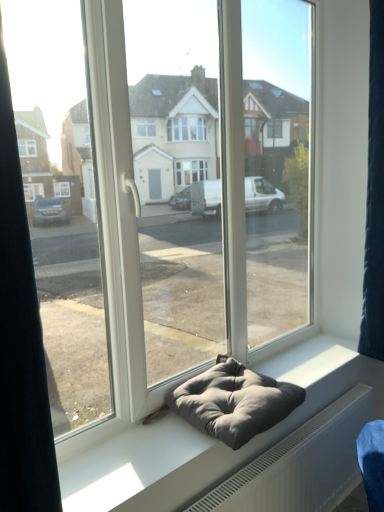
This screenshot has width=384, height=512. What do you see at coordinates (202, 434) in the screenshot?
I see `gray fabric cushion at center` at bounding box center [202, 434].

Locate an element on the screen. transparent glass door at center is located at coordinates (210, 200).

Between dark blue fabric at right and gray fabric cushion at center, which one has larger size?

dark blue fabric at right is bigger.

From their relative heights in the image, would you say dark blue fabric at right is taller or shorter than gray fabric cushion at center?

dark blue fabric at right is taller than gray fabric cushion at center.

In the scene shown: Is dark blue fabric at right completely or partially outside of gray fabric cushion at center?

Yes, dark blue fabric at right is not within gray fabric cushion at center.

How distant is dark blue fabric at right from gray fabric cushion at center?

Answer: They are 33.38 inches apart.

Is gray fabric bean bag at center facing away from dark blue fabric at right?

No, gray fabric bean bag at center's orientation is not away from dark blue fabric at right.

This screenshot has width=384, height=512. Identify the location of bean bag chair that appears in front of the dark blue fabric at right. (234, 402).

Considering the sizes of gray fabric bean bag at center and dark blue fabric at right in the image, is gray fabric bean bag at center taller or shorter than dark blue fabric at right?

In the image, gray fabric bean bag at center appears to be shorter than dark blue fabric at right.

Is transparent glass door at center next to dark blue fabric at right?

No, transparent glass door at center is not next to dark blue fabric at right.

From the picture: In terms of height, does transparent glass door at center look taller or shorter compared to dark blue fabric at right?

transparent glass door at center is taller than dark blue fabric at right.

Considering the positions of point (269, 314) and point (383, 276), is point (269, 314) closer or farther from the camera than point (383, 276)?

Point (269, 314).

From a real-world perspective, between transparent glass door at center and gray fabric bean bag at center, who is vertically lower?

From a 3D spatial view, gray fabric bean bag at center is below.

How different are the orientations of transparent glass door at center and gray fabric bean bag at center in degrees?

The angle between the facing direction of transparent glass door at center and the facing direction of gray fabric bean bag at center is 1.66 degrees.

Is transparent glass door at center beside gray fabric bean bag at center?

No, transparent glass door at center is not in contact with gray fabric bean bag at center.

Is transparent glass door at center bigger than gray fabric bean bag at center?

Indeed, transparent glass door at center has a larger size compared to gray fabric bean bag at center.

From a real-world perspective, which object stands above the other?

transparent glass door at center.

Considering the points (220, 365) and (124, 217), which point is in front, point (220, 365) or point (124, 217)?

The point (124, 217) is in front.

Consider the image. Is gray fabric bean bag at center turned away from transparent glass door at center?

Yes, gray fabric bean bag at center is facing away from transparent glass door at center.

The height and width of the screenshot is (512, 384). In order to click on glass door lying on the left of gray fabric cushion at center in this screenshot , I will do `click(210, 200)`.

Considering the relative sizes of gray fabric cushion at center and transparent glass door at center in the image provided, is gray fabric cushion at center taller than transparent glass door at center?

No, gray fabric cushion at center is not taller than transparent glass door at center.

From a real-world perspective, is gray fabric cushion at center above or below transparent glass door at center?

In terms of real-world spatial position, gray fabric cushion at center is below transparent glass door at center.

In the scene shown: Is gray fabric cushion at center oriented away from transparent glass door at center?

gray fabric cushion at center is not turned away from transparent glass door at center.

From the image's perspective, which object appears higher, transparent glass door at center or gray fabric cushion at center?

transparent glass door at center, from the image's perspective.

From a real-world perspective, is transparent glass door at center located higher than gray fabric cushion at center?

Indeed, from a real-world perspective, transparent glass door at center stands above gray fabric cushion at center.

Considering the sizes of objects transparent glass door at center and gray fabric cushion at center in the image provided, who is wider, transparent glass door at center or gray fabric cushion at center?

gray fabric cushion at center.

The width and height of the screenshot is (384, 512). What are the coordinates of `curtain behind the gray fabric cushion at center` in the screenshot? It's located at (374, 197).

The image size is (384, 512). In order to click on curtain lying above the gray fabric bean bag at center (from the image's perspective) in this screenshot , I will do `click(374, 197)`.

When comparing their distances from gray fabric cushion at center, does gray fabric bean bag at center or dark blue fabric at right seem further?

Based on the image, dark blue fabric at right appears to be further to gray fabric cushion at center.

Which object lies nearer to the anchor point dark blue fabric at right, transparent glass door at center or gray fabric bean bag at center?

transparent glass door at center.

Considering their positions, is dark blue fabric at right positioned further to gray fabric cushion at center than transparent glass door at center?

dark blue fabric at right is positioned further to the anchor gray fabric cushion at center.

Estimate the real-world distances between objects in this image. Which object is closer to transparent glass door at center, gray fabric bean bag at center or gray fabric cushion at center?

gray fabric bean bag at center lies closer to transparent glass door at center than the other object.

When comparing their distances from gray fabric cushion at center, does transparent glass door at center or gray fabric bean bag at center seem further?

transparent glass door at center.

From the image, which object appears to be nearer to dark blue fabric at right, gray fabric bean bag at center or transparent glass door at center?

Among the two, transparent glass door at center is located nearer to dark blue fabric at right.

Looking at the image, which one is located further to gray fabric bean bag at center, dark blue fabric at right or gray fabric cushion at center?

dark blue fabric at right is further to gray fabric bean bag at center.

Looking at the image, which one is located closer to transparent glass door at center, gray fabric cushion at center or gray fabric bean bag at center?

Among the two, gray fabric bean bag at center is located nearer to transparent glass door at center.

Where is `bean bag chair between transparent glass door at center and gray fabric cushion at center vertically`? The image size is (384, 512). bean bag chair between transparent glass door at center and gray fabric cushion at center vertically is located at coordinates (234, 402).

This screenshot has width=384, height=512. What are the coordinates of `curtain between transparent glass door at center and gray fabric cushion at center vertically` in the screenshot? It's located at (374, 197).

You are a GUI agent. You are given a task and a screenshot of the screen. Output one action in this format:
    pyautogui.click(x=<x>, y=<y>)
    Task: Click on the bean bag chair between dark blue fabric at right and gray fabric cushion at center vertically
    The height and width of the screenshot is (512, 384).
    Given the screenshot: What is the action you would take?
    pyautogui.click(x=234, y=402)

Find the location of a particular element. Image resolution: width=384 pixels, height=512 pixels. curtain between transparent glass door at center and gray fabric bean bag at center in the up-down direction is located at coordinates (374, 197).